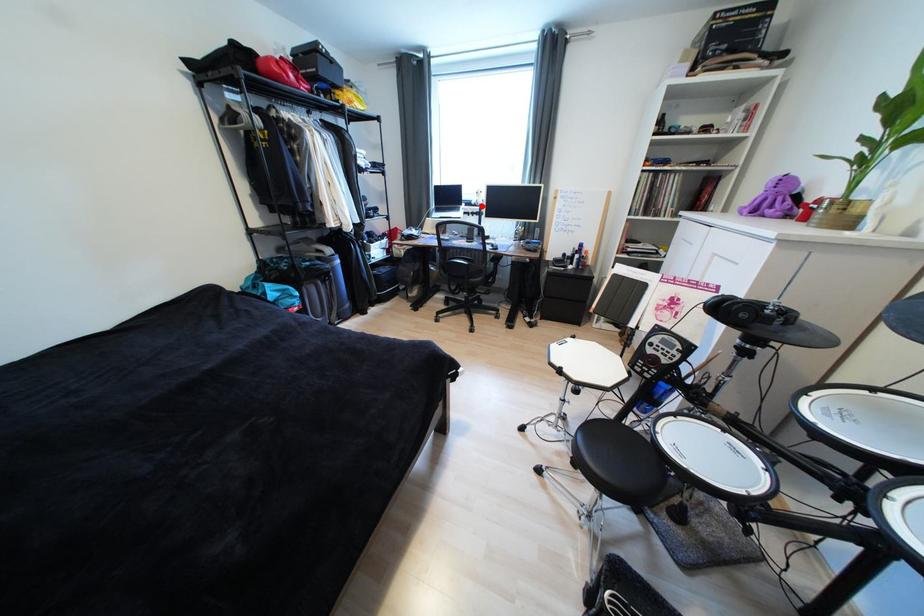
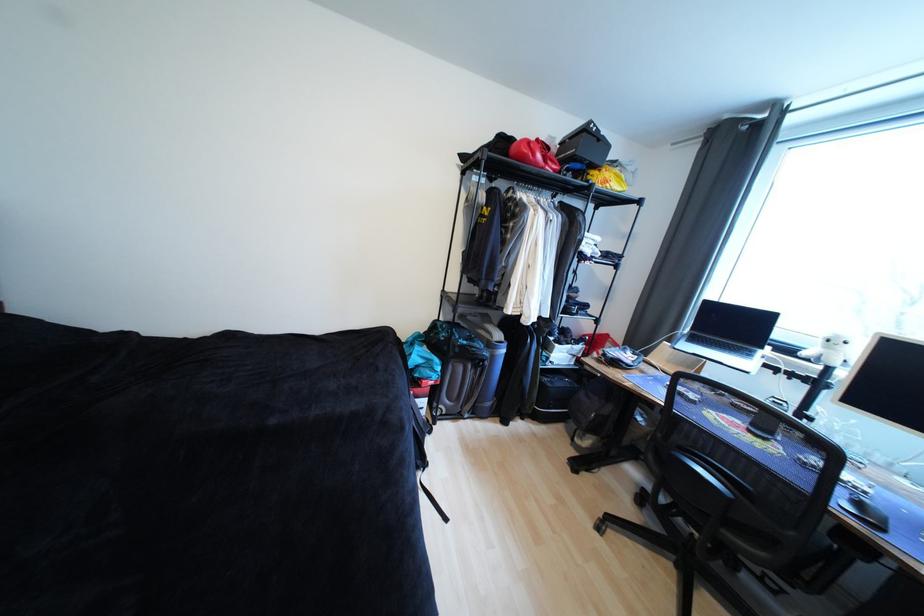
In the second image, find the point that corresponds to the highlighted location in the first image.

(812, 361)